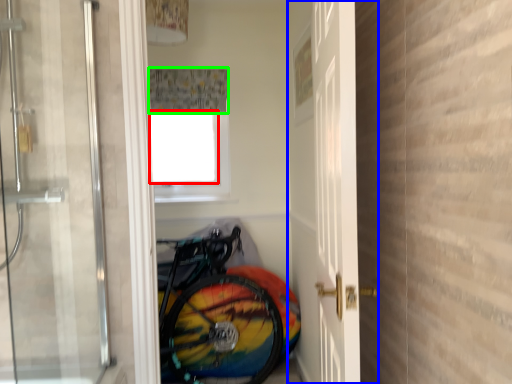
Question: Estimate the real-world distances between objects in this image. Which object is farther from window screen (highlighted by a red box), door (highlighted by a blue box) or shower curtain (highlighted by a green box)?

Choices:
 (A) door
 (B) shower curtain

Answer: (A)